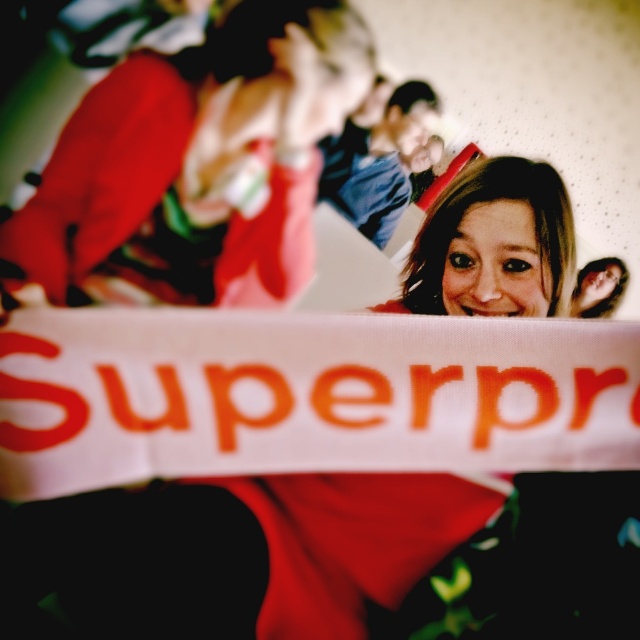
Question: Does white fabric sign at center appear over matte red hoodie at upper left?

Choices:
 (A) no
 (B) yes

Answer: (A)

Question: Is white fabric sign at center positioned before matte red hoodie at upper left?

Choices:
 (A) no
 (B) yes

Answer: (B)

Question: Does white fabric sign at center come behind matte red hoodie at upper left?

Choices:
 (A) yes
 (B) no

Answer: (B)